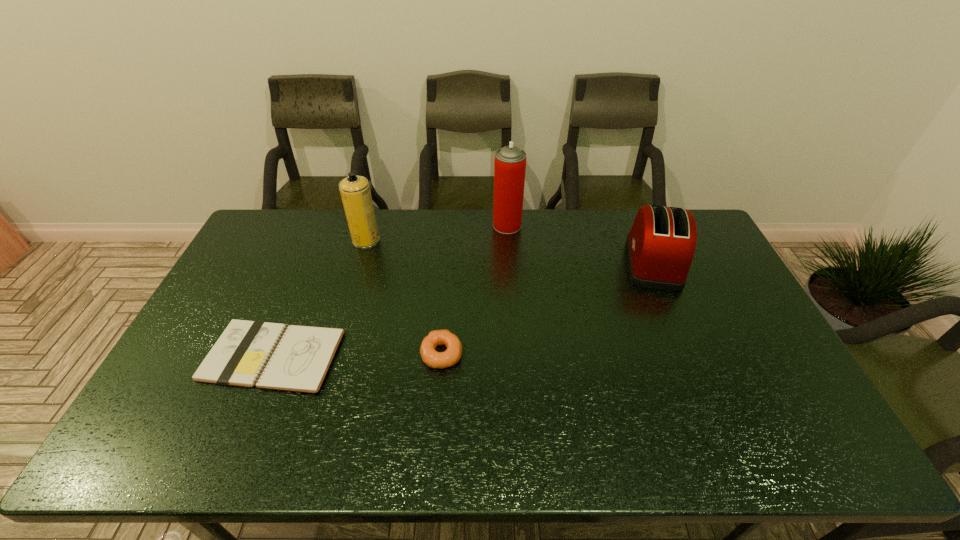
Where is `the right aerosol can`? Image resolution: width=960 pixels, height=540 pixels. the right aerosol can is located at coordinates (510, 161).

Image resolution: width=960 pixels, height=540 pixels. What are the coordinates of `the tallest object` in the screenshot? It's located at (510, 161).

The image size is (960, 540). I want to click on the fourth shortest object, so click(x=355, y=192).

The height and width of the screenshot is (540, 960). I want to click on the shorter aerosol can, so coord(355,192).

Identify the location of toaster. (660, 246).

The width and height of the screenshot is (960, 540). In order to click on the third tallest object in this screenshot , I will do `click(660, 246)`.

Image resolution: width=960 pixels, height=540 pixels. I want to click on doughnut, so click(432, 358).

You are a GUI agent. You are given a task and a screenshot of the screen. Output one action in this format:
    pyautogui.click(x=<x>, y=<y>)
    Task: Click on the second shortest object
    
    Given the screenshot: What is the action you would take?
    pyautogui.click(x=432, y=358)

Locate an element on the screen. the shortest object is located at coordinates (273, 356).

Find the location of a particular element. vacant space positioned on the right of the tallest object is located at coordinates (554, 226).